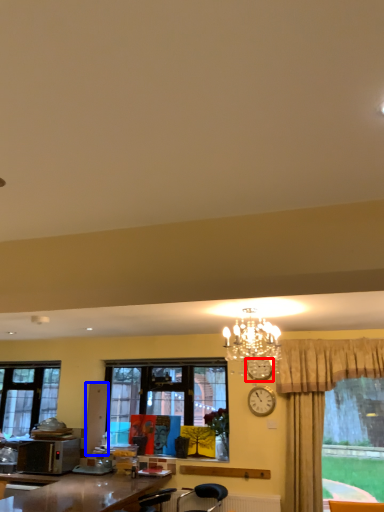
Question: Among these objects, which one is farthest to the camera, clock (highlighted by a red box) or cabinetry (highlighted by a blue box)?

Choices:
 (A) clock
 (B) cabinetry

Answer: (B)